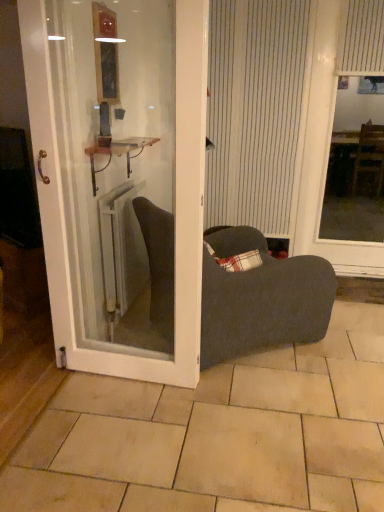
Question: Is metallic copper cabinet at center taller than white metallic radiator at center?

Choices:
 (A) no
 (B) yes

Answer: (A)

Question: Is metallic copper cabinet at center in front of white metallic radiator at center?

Choices:
 (A) no
 (B) yes

Answer: (B)

Question: Considering the relative sizes of metallic copper cabinet at center and white metallic radiator at center in the image provided, is metallic copper cabinet at center smaller than white metallic radiator at center?

Choices:
 (A) yes
 (B) no

Answer: (A)

Question: Is metallic copper cabinet at center looking in the opposite direction of white metallic radiator at center?

Choices:
 (A) yes
 (B) no

Answer: (B)

Question: From a real-world perspective, is metallic copper cabinet at center physically above white metallic radiator at center?

Choices:
 (A) yes
 (B) no

Answer: (A)

Question: Does metallic copper cabinet at center appear on the left side of white metallic radiator at center?

Choices:
 (A) yes
 (B) no

Answer: (B)

Question: Is dark gray fabric chair at center aimed at beige tile at center?

Choices:
 (A) yes
 (B) no

Answer: (B)

Question: Can you confirm if dark gray fabric chair at center is positioned to the left of beige tile at center?

Choices:
 (A) no
 (B) yes

Answer: (B)

Question: Does dark gray fabric chair at center contain beige tile at center?

Choices:
 (A) yes
 (B) no

Answer: (B)

Question: From the image's perspective, is dark gray fabric chair at center under beige tile at center?

Choices:
 (A) yes
 (B) no

Answer: (B)

Question: From the image's perspective, is dark gray fabric chair at center on beige tile at center?

Choices:
 (A) no
 (B) yes

Answer: (B)

Question: Does dark gray fabric chair at center come behind beige tile at center?

Choices:
 (A) no
 (B) yes

Answer: (B)

Question: From the image's perspective, is metallic copper cabinet at center located above white glossy door at center?

Choices:
 (A) yes
 (B) no

Answer: (A)